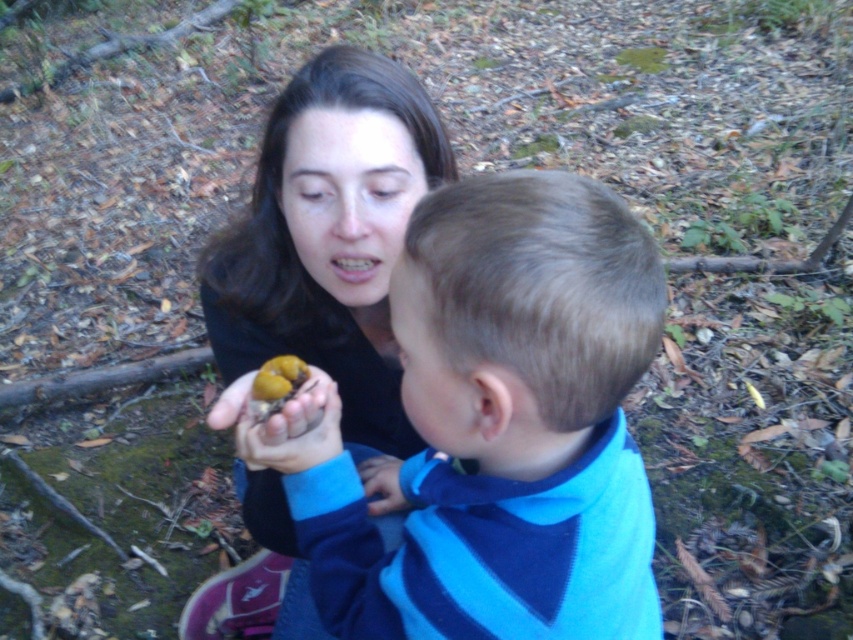
You are a photographer trying to capture a closeup of the blue striped sweater at center and the matte black sweater at center. Your camera has a maximum focus range of 12 inches. Can you focus on both sweaters at the same time?

The blue striped sweater at center is 12.33 inches away from the matte black sweater at center. Since the distance between them exceeds the camera maximum focus range of 12 inches, you cannot focus on both sweaters at the same time.

You are a photographer trying to capture the child in the blue and navy striped sweater. You want to ensure the focus is on the child while keeping the adult and the object they hold in the background. Based on the scene, where should you position the camera relative to the point at coordinates (x=498, y=428)?

The blue striped sweater at center is located at point (x=498, y=428). To focus on the child wearing the blue and navy striped sweater, position the camera directly at the point (x=498, y=428) to ensure the child is centered and in focus while the adult and the object they hold are in the background.